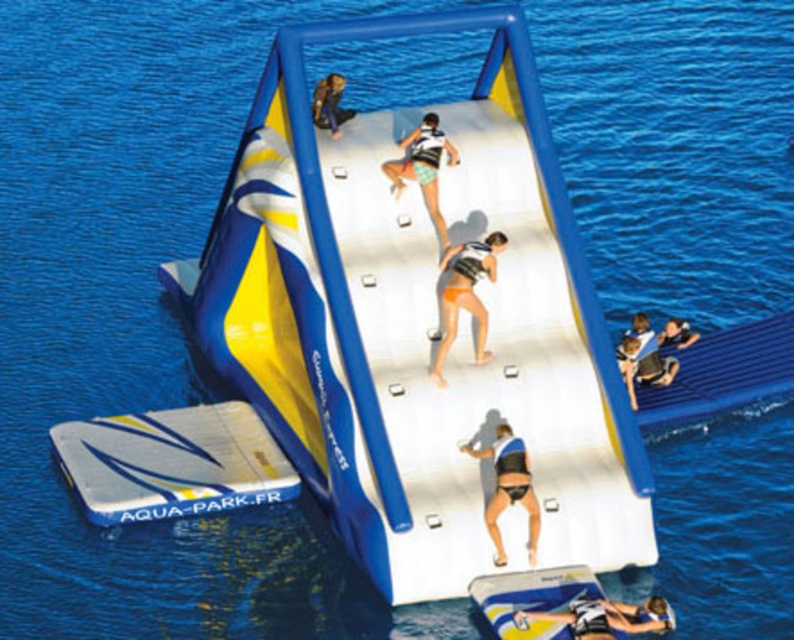
You are a lifeguard on duty at the aqua park. You notice a swimmer in trouble near the tan bikini at center and need to retrieve the white matte surfboard at lower right to assist them. Is the surfboard within a 5 meter radius of the swimmer?

The distance between the tan bikini at center and the white matte surfboard at lower right is 5.29 meters. Since the surfboard is slightly beyond the 5 meter radius, it is just outside the required distance for immediate retrieval.

You are a lifeguard observing the aqua park scene. You notice two objects in the image. One is the tan bikini at center and the other is the white matte surfboard at lower right. Which object takes up more space in the image?

The tan bikini at center has a larger size compared to the white matte surfboard at lower right, so the tan bikini at center takes up more space in the image.